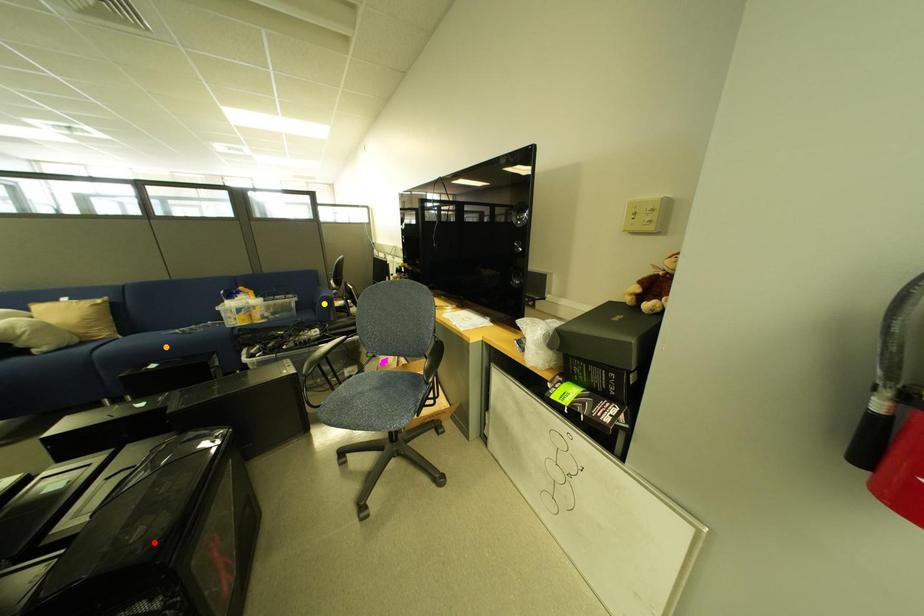
Order these from farthest to nearest:
1. red point
2. yellow point
3. orange point

yellow point, orange point, red point